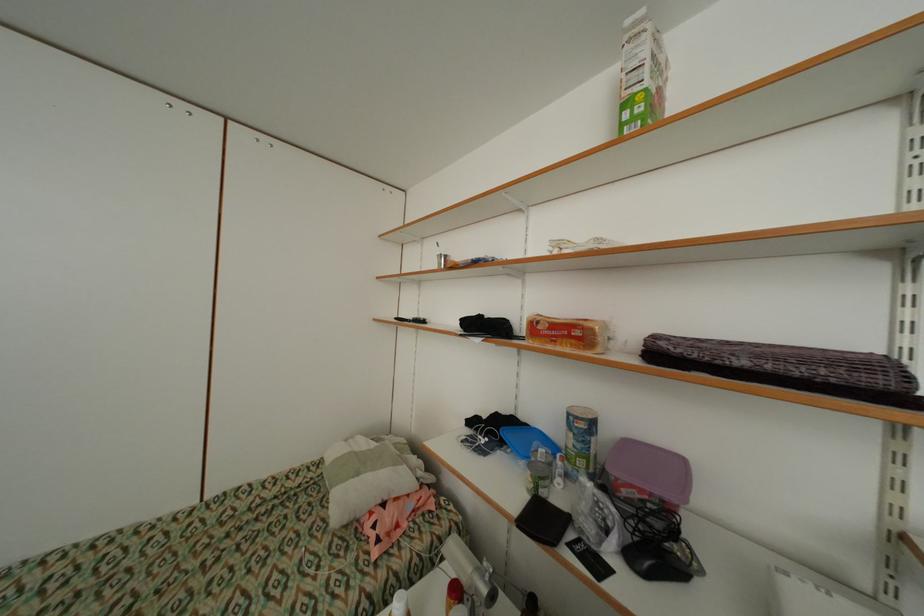
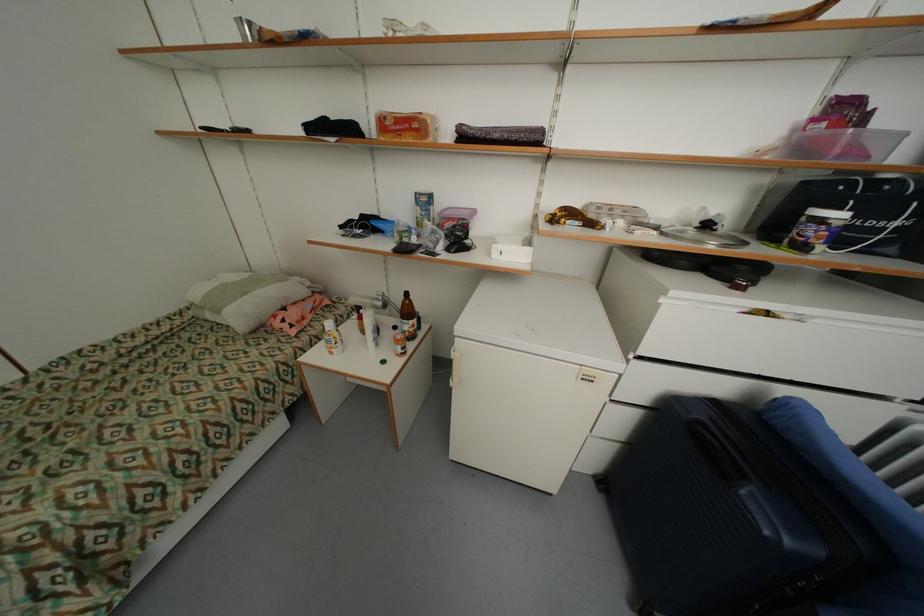
Where in the second image is the point corresponding to [584,334] from the first image?

(421, 126)